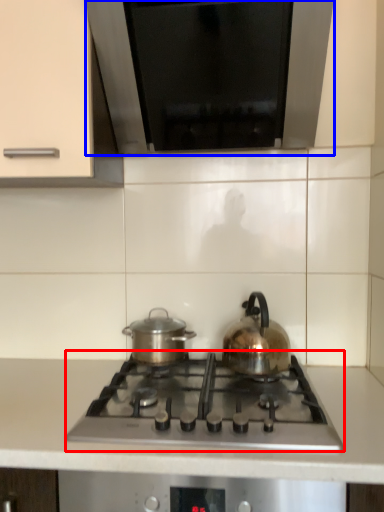
Question: Which of the following is the closest to the observer, gas stove (highlighted by a red box) or exhaust hood (highlighted by a blue box)?

Choices:
 (A) gas stove
 (B) exhaust hood

Answer: (A)